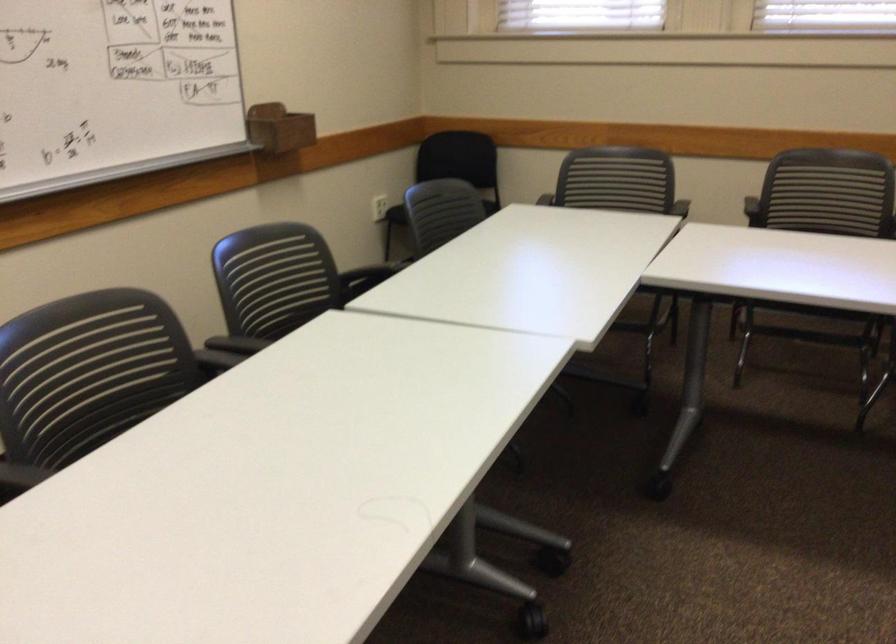
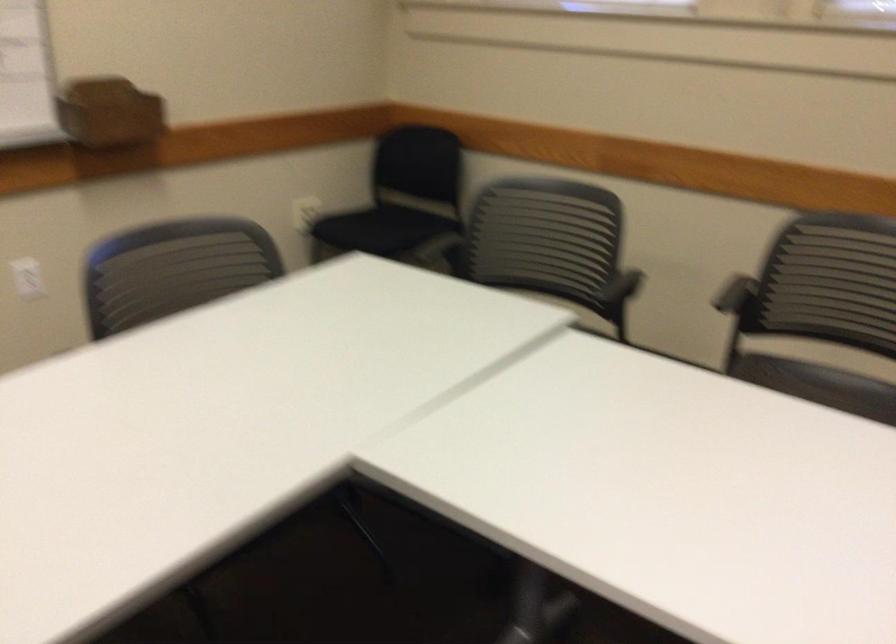
The images are taken continuously from a first-person perspective. In which direction are you moving?

The cameraman moved toward right, forward.